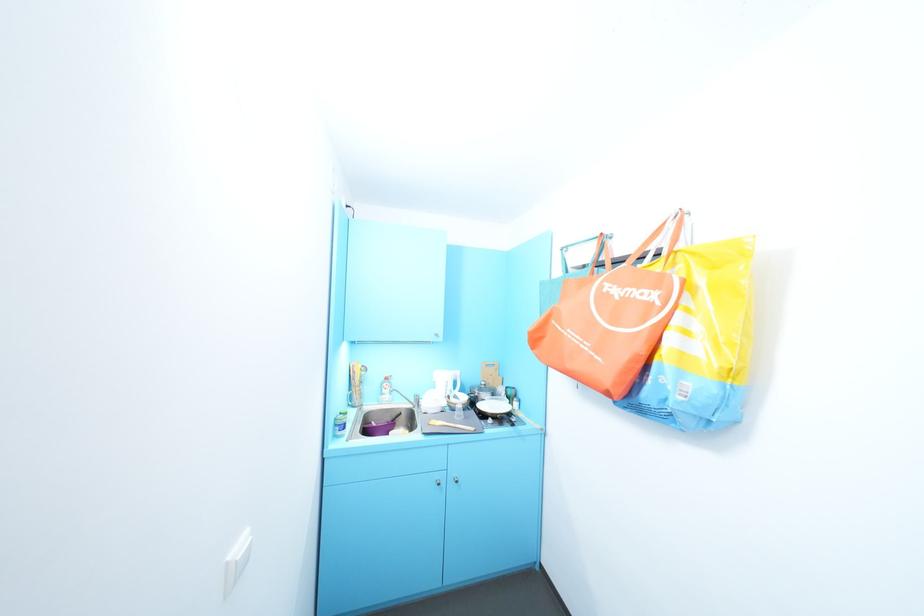
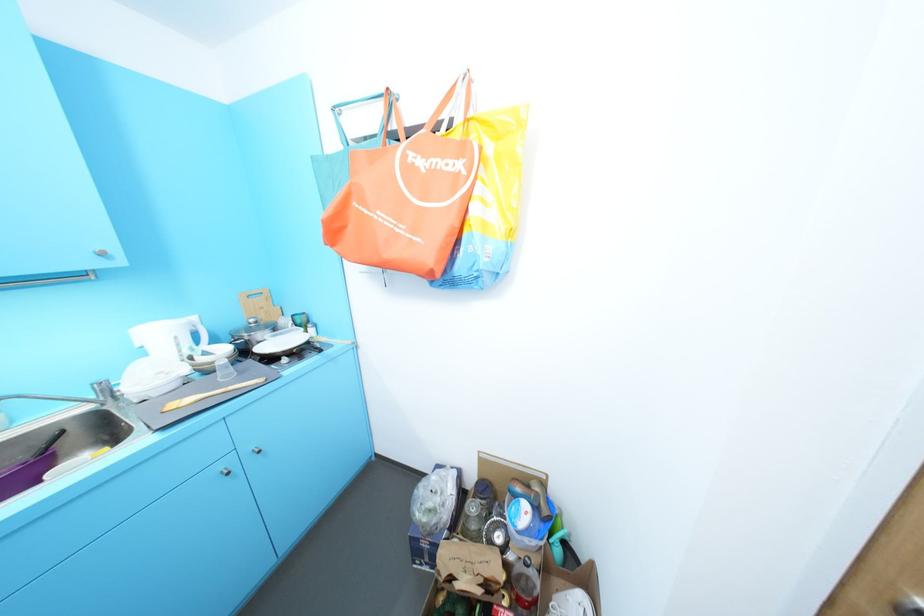
Based on the continuous images, in which direction is the camera rotating?

The camera's rotation is toward right-down.